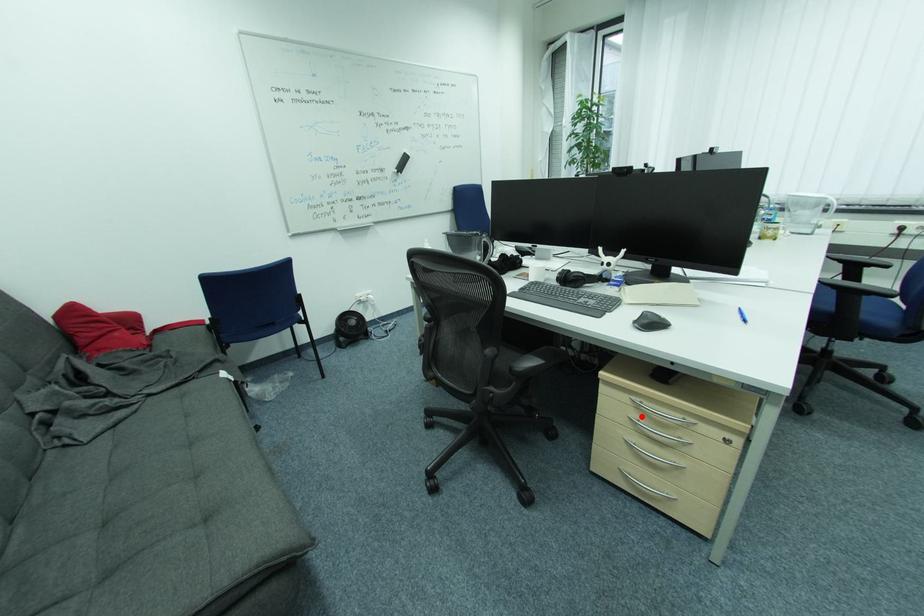
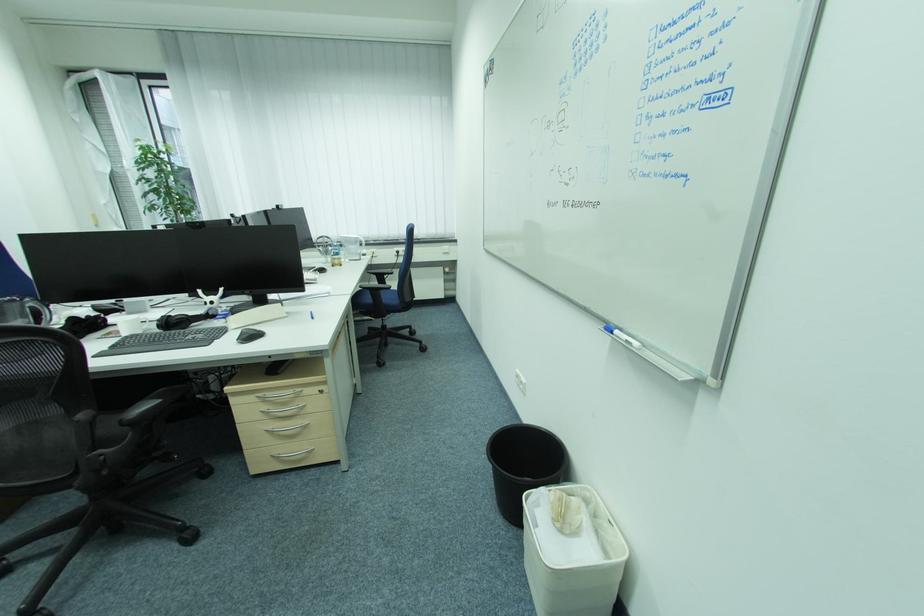
In the second image, find the point that corresponds to the highlighted location in the first image.

(272, 408)